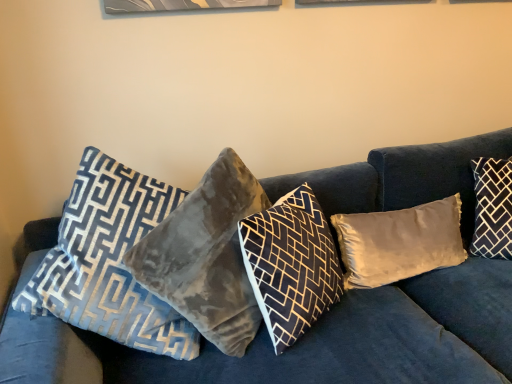
Question: Visually, is dark gray velvet pillow at right, the first pillow in the right-to-left sequence, positioned to the left or to the right of velvet gray pillow at center, positioned as the 4th pillow in right-to-left order?

Choices:
 (A) right
 (B) left

Answer: (A)

Question: Is point (507, 205) positioned closer to the camera than point (176, 246)?

Choices:
 (A) closer
 (B) farther

Answer: (B)

Question: Which of these objects is positioned farthest from the velvet gray pillow at center, acting as the 2th pillow starting from the left?

Choices:
 (A) velvet gray pillow at center, the 3th pillow viewed from the left
 (B) velvet blue couch at center
 (C) velvet blue pillow at left, which appears as the first pillow when viewed from the left
 (D) satin beige pillow at center, which is counted as the 2th pillow, starting from the right
 (E) dark gray velvet pillow at right, the 5th pillow in the left-to-right sequence

Answer: (E)

Question: Estimate the real-world distances between objects in this image. Which object is farther from the velvet blue pillow at left, which is the 5th pillow in right-to-left order?

Choices:
 (A) satin beige pillow at center, which is counted as the 2th pillow, starting from the right
 (B) velvet gray pillow at center, positioned as the 4th pillow in right-to-left order
 (C) velvet blue couch at center
 (D) dark gray velvet pillow at right, the 5th pillow in the left-to-right sequence
 (E) velvet gray pillow at center, the 3th pillow viewed from the left

Answer: (D)